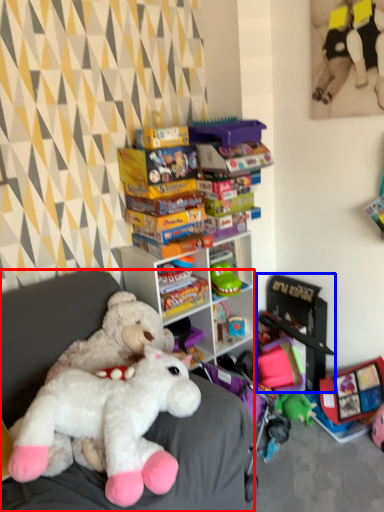
Question: Which of the following is the closest to the observer, furniture (highlighted by a red box) or toy (highlighted by a blue box)?

Choices:
 (A) furniture
 (B) toy

Answer: (A)